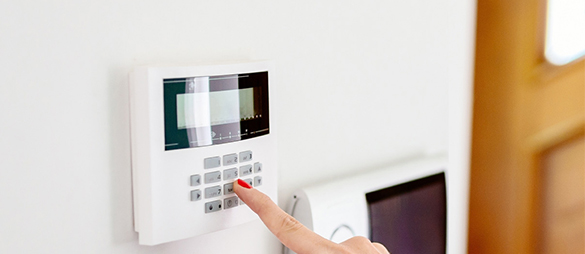
The image size is (585, 254). I want to click on screen, so click(205, 114).